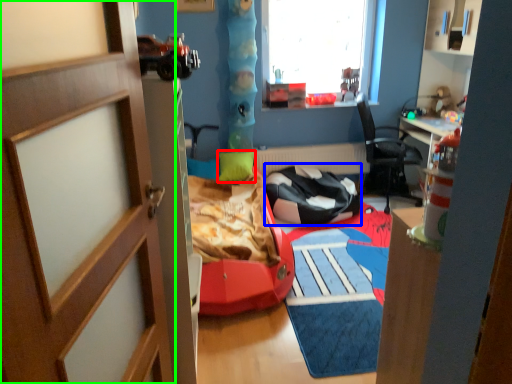
Question: Considering the real-world distances, which object is closest to pillow (highlighted by a red box)? chair (highlighted by a blue box) or door (highlighted by a green box).

Choices:
 (A) chair
 (B) door

Answer: (A)